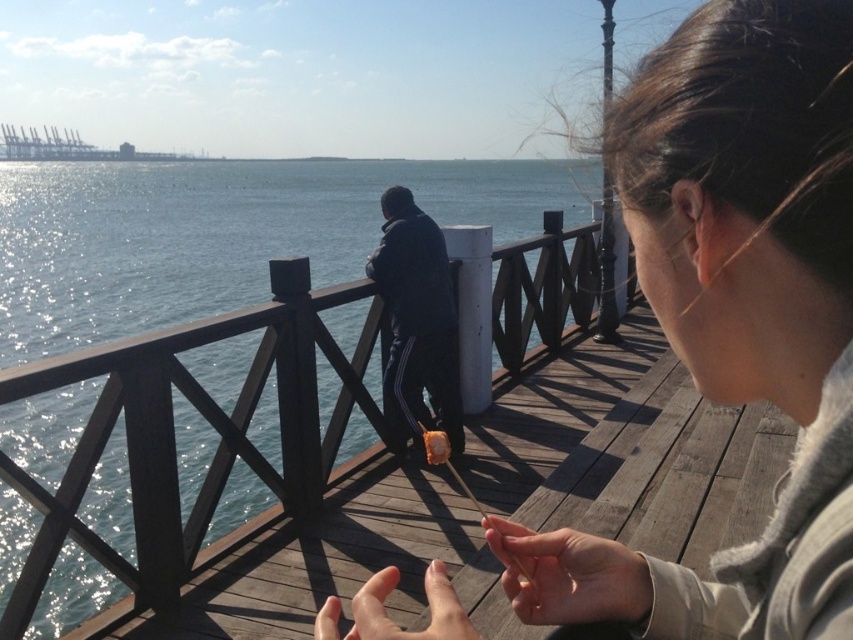
You are standing at the edge of the pier and notice a dark blue fabric jacket at center. If you want to pick it up, in which general direction should you move from your current position?

The dark blue fabric jacket at center is located at point (416, 321), which is near the center of the scene. Since you are at the edge of the pier, you should move towards the center to reach it.

You are standing at the pier and see a dark blue fabric jacket at center and a smooth skin hand at center. Which object is positioned to the right?

The smooth skin hand at center is positioned to the right of the dark blue fabric jacket at center.

Looking at this image, you are a photographer trying to capture a candid shot of the scene. You notice the dark blue fabric jacket at center and the smooth skin hand at center. Which object is wider when viewed from your current position?

The dark blue fabric jacket at center is wider than the smooth skin hand at center.